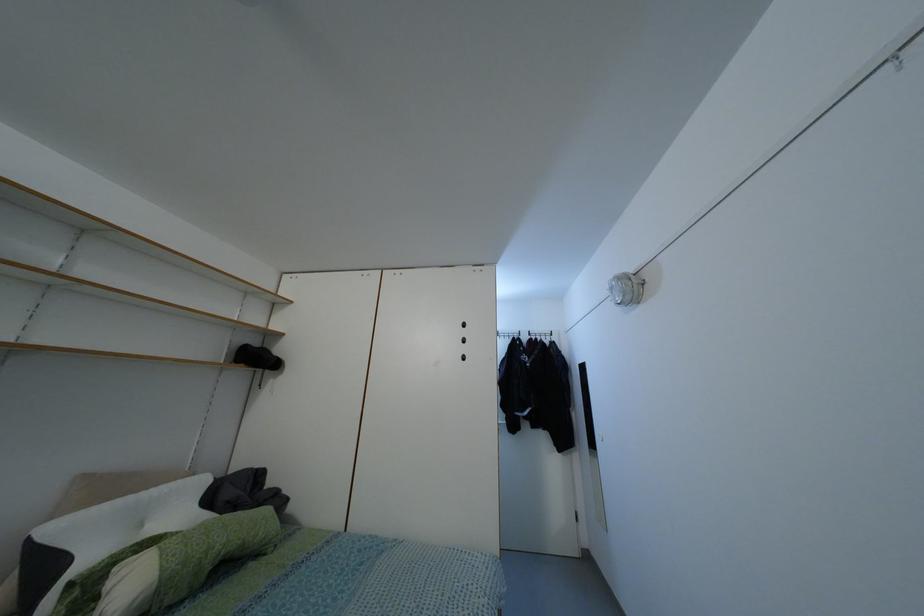
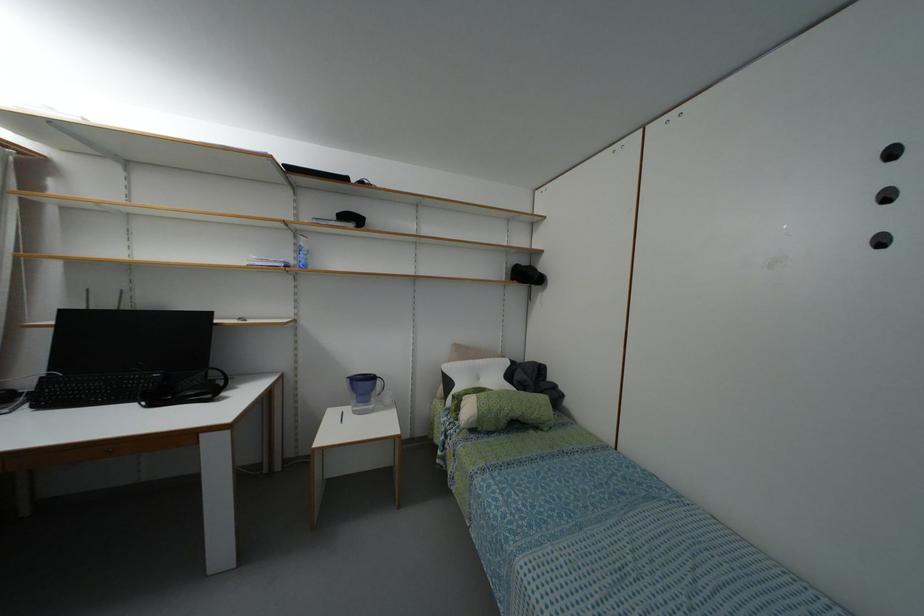
Question: The camera is either moving clockwise (left) or counter-clockwise (right) around the object. The first image is from the beginning of the video and the second image is from the end. Is the camera moving left or right when shooting the video?

Choices:
 (A) Left
 (B) Right

Answer: (B)